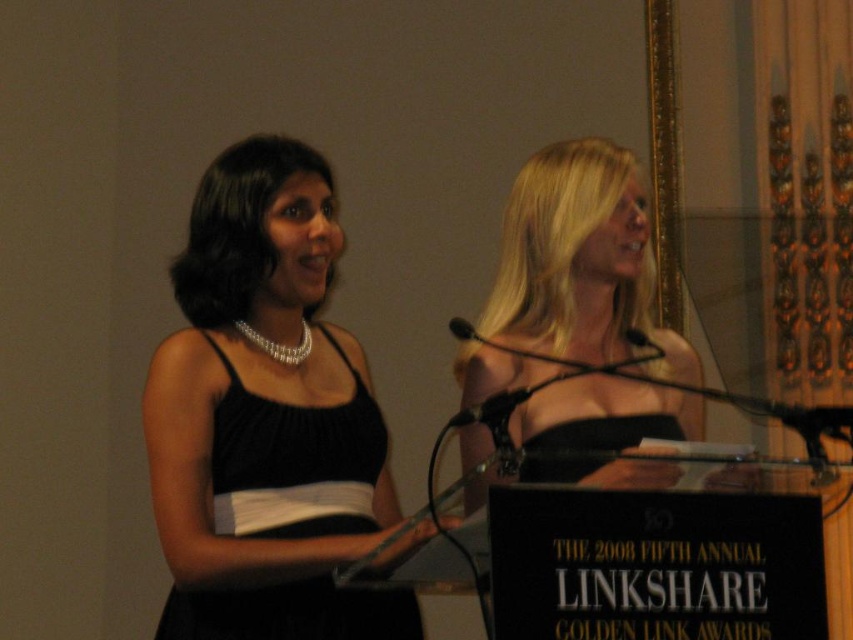
Question: Does blonde hair at center have a lesser width compared to black plastic microphone at center?

Choices:
 (A) no
 (B) yes

Answer: (A)

Question: Among these objects, which one is farthest from the camera?

Choices:
 (A) black matte microphone at center
 (B) black satin dress at center
 (C) black plastic microphone at center
 (D) blonde hair at center

Answer: (D)

Question: Can you confirm if black satin dress at center is positioned below black plastic microphone at center?

Choices:
 (A) no
 (B) yes

Answer: (A)

Question: Among these points, which one is farthest from the camera?

Choices:
 (A) (521, 269)
 (B) (509, 406)
 (C) (318, 458)
 (D) (451, 326)

Answer: (A)

Question: Is black satin dress at center positioned at the back of black plastic microphone at center?

Choices:
 (A) yes
 (B) no

Answer: (A)

Question: Which point is closer to the camera taking this photo?

Choices:
 (A) (593, 160)
 (B) (471, 416)

Answer: (B)